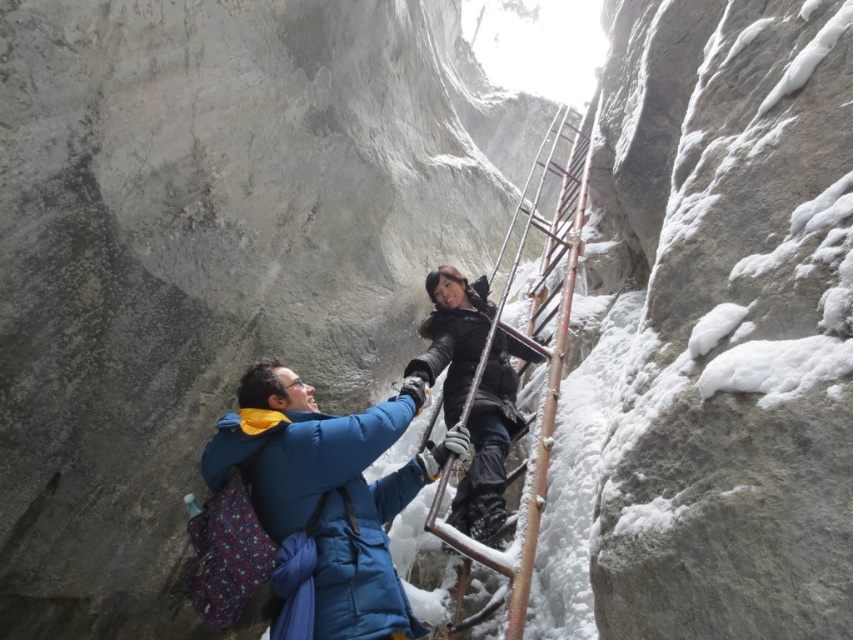
Question: Based on their relative distances, which object is farther from the black matte jacket at center?

Choices:
 (A) blue down jacket at center
 (B) rusty metal ladder at center

Answer: (B)

Question: Which point is closer to the camera?

Choices:
 (A) blue down jacket at center
 (B) rusty metal ladder at center
 (C) black matte jacket at center

Answer: (A)

Question: Is the position of blue down jacket at center less distant than that of black matte jacket at center?

Choices:
 (A) no
 (B) yes

Answer: (B)

Question: Does blue down jacket at center have a smaller size compared to rusty metal ladder at center?

Choices:
 (A) yes
 (B) no

Answer: (A)

Question: Does blue down jacket at center appear over rusty metal ladder at center?

Choices:
 (A) no
 (B) yes

Answer: (A)

Question: Which of the following is the closest to the observer?

Choices:
 (A) rusty metal ladder at center
 (B) blue down jacket at center

Answer: (B)